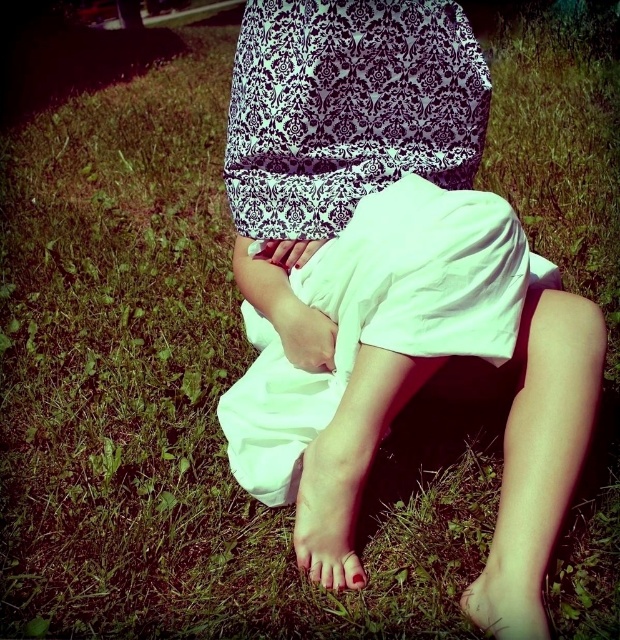
Question: Which point is farther to the camera?

Choices:
 (A) (498, 563)
 (B) (446, 19)

Answer: (B)

Question: Which point is closer to the camera?

Choices:
 (A) white cotton shorts at center
 (B) nude skin foot at lower center

Answer: (B)

Question: Is white cotton shorts at center wider than nude skin foot at lower center?

Choices:
 (A) yes
 (B) no

Answer: (A)

Question: Where is white cotton shorts at center located in relation to nude skin foot at lower center in the image?

Choices:
 (A) right
 (B) left

Answer: (B)

Question: Where is white cotton shorts at center located in relation to nude skin foot at lower center in the image?

Choices:
 (A) below
 (B) above

Answer: (B)